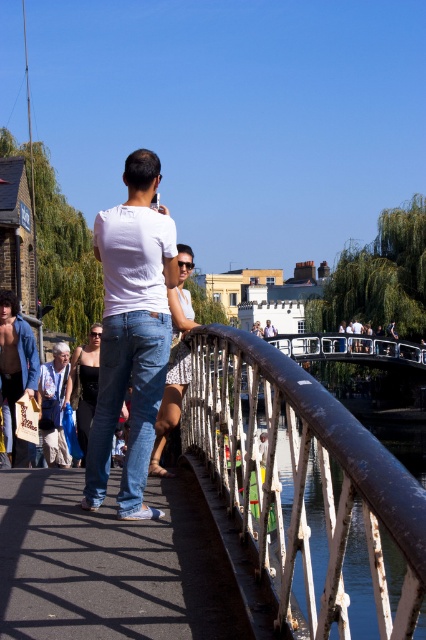
Does white printed tank top at center have a greater width compared to denim jeans at lower left?

No, white printed tank top at center is not wider than denim jeans at lower left.

Does point (169, 296) come behind point (11, 394)?

No, (169, 296) is in front of (11, 394).

Is point (175, 369) less distant than point (14, 348)?

Yes, point (175, 369) is closer to viewer.

You are a GUI agent. You are given a task and a screenshot of the screen. Output one action in this format:
    pyautogui.click(x=<x>, y=<y>)
    Task: Click on the white printed tank top at center
    
    Given the screenshot: What is the action you would take?
    pyautogui.click(x=175, y=362)

Which is more to the right, denim jeans at lower left or black denim jeans at center?

Positioned to the right is black denim jeans at center.

You are a GUI agent. You are given a task and a screenshot of the screen. Output one action in this format:
    pyautogui.click(x=<x>, y=<y>)
    Task: Click on the denim jeans at lower left
    This screenshot has height=640, width=426.
    Given the screenshot: What is the action you would take?
    pyautogui.click(x=17, y=365)

Between point (16, 321) and point (92, 330), which one is positioned in front?

Positioned in front is point (16, 321).

You are a GUI agent. You are given a task and a screenshot of the screen. Output one action in this format:
    pyautogui.click(x=<x>, y=<y>)
    Task: Click on the denim jeans at lower left
    The width and height of the screenshot is (426, 640).
    Given the screenshot: What is the action you would take?
    pyautogui.click(x=17, y=365)

Who is lower down, rusty metal railing at center or white cotton shirt at upper center?

rusty metal railing at center is below.

Image resolution: width=426 pixels, height=640 pixels. In order to click on rusty metal railing at center in this screenshot , I will do `click(307, 486)`.

Who is more distant from viewer, (339, 436) or (275, 328)?

The point (275, 328) is more distant.

Where is `rusty metal railing at center`? The height and width of the screenshot is (640, 426). rusty metal railing at center is located at coordinates (307, 486).